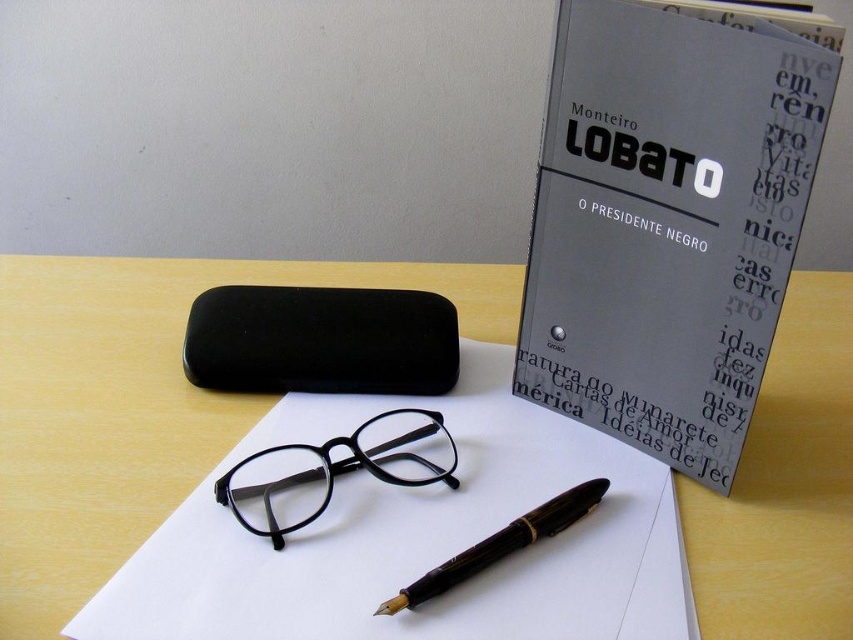
Question: Is black plastic glasses at center to the left of brown wood fountain pen at center from the viewer's perspective?

Choices:
 (A) no
 (B) yes

Answer: (B)

Question: Can you confirm if wooden table at center is positioned below black plastic glasses at center?

Choices:
 (A) no
 (B) yes

Answer: (A)

Question: Which object is the closest to the brown wood fountain pen at center?

Choices:
 (A) matte gray book at upper right
 (B) black plastic glasses at center
 (C) wooden table at center

Answer: (B)

Question: Which of the following is the farthest from the observer?

Choices:
 (A) (372, 468)
 (B) (605, 413)

Answer: (B)

Question: Is wooden table at center behind matte gray book at upper right?

Choices:
 (A) no
 (B) yes

Answer: (B)

Question: Based on their relative distances, which object is nearer to the matte gray book at upper right?

Choices:
 (A) brown wood fountain pen at center
 (B) wooden table at center

Answer: (A)